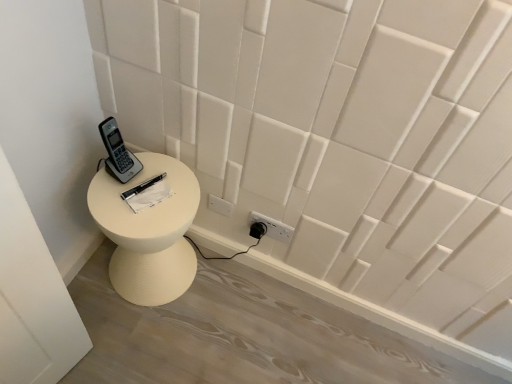
Where is `free location to the right of white paper at center`? Image resolution: width=512 pixels, height=384 pixels. free location to the right of white paper at center is located at coordinates (182, 195).